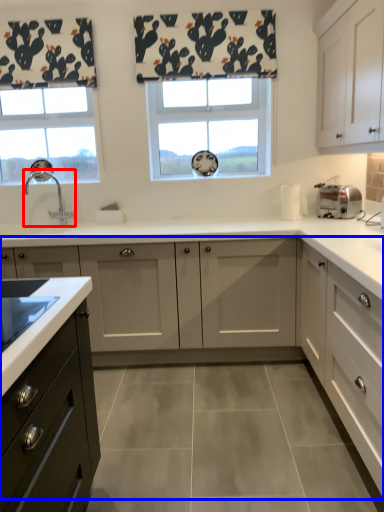
Question: Which object is closer to the camera taking this photo, tap (highlighted by a red box) or cabinetry (highlighted by a blue box)?

Choices:
 (A) tap
 (B) cabinetry

Answer: (B)